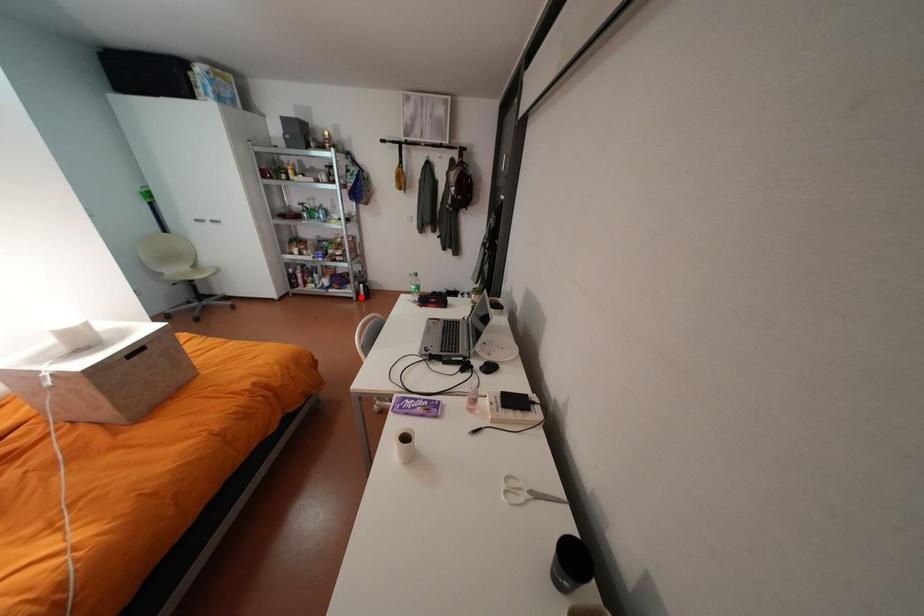
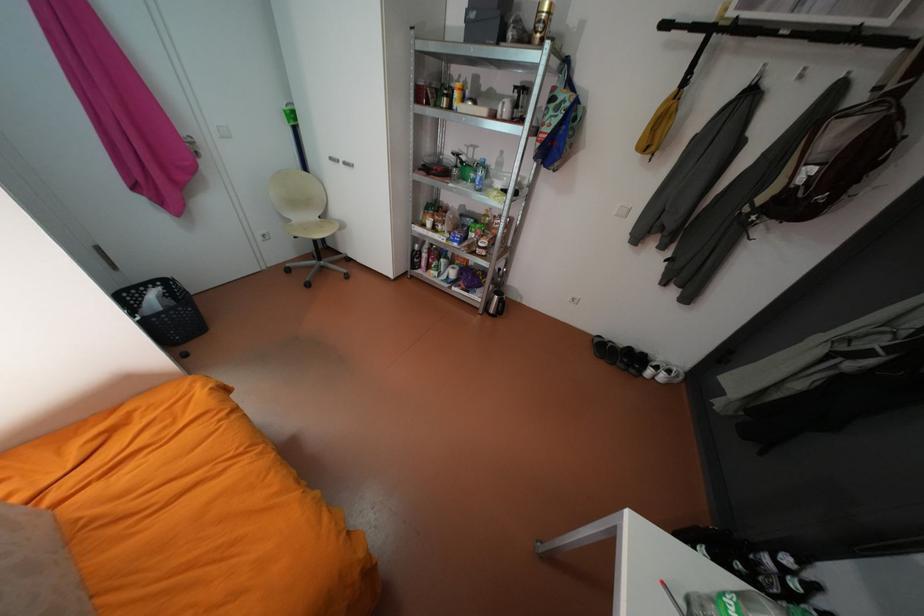
Question: I am providing you with two images of the same scene from different viewpoints. Given a red point in image1, look at the same physical point in image2. Is it:

Choices:
 (A) Closer to the viewpoint
 (B) Farther from the viewpoint

Answer: (A)